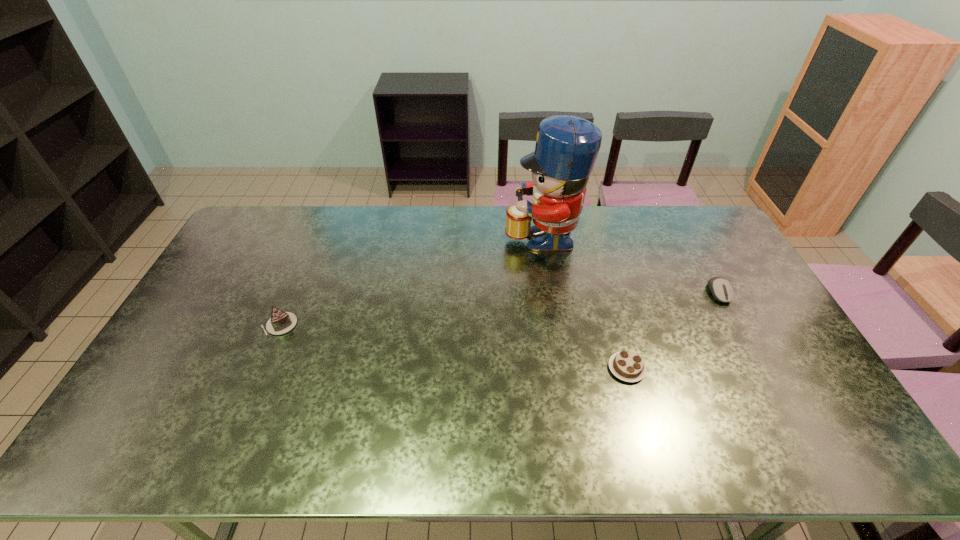
Image resolution: width=960 pixels, height=540 pixels. In order to click on free space between the nearest object and the nutcracker in this screenshot , I will do `click(585, 301)`.

Identify the location of free point between the second farthest object and the farthest object. Image resolution: width=960 pixels, height=540 pixels. (631, 264).

Locate an element on the screen. free space between the farther chocolate cake and the second farthest object is located at coordinates (499, 309).

At what (x,y) coordinates should I click in order to perform the action: click on vacant area between the tallest object and the right chocolate cake. Please return your answer as a coordinate pair (x, y). Image resolution: width=960 pixels, height=540 pixels. Looking at the image, I should click on (585, 301).

The width and height of the screenshot is (960, 540). I want to click on blank region between the second shortest object and the nearest object, so click(673, 330).

At what (x,y) coordinates should I click in order to perform the action: click on empty space between the nutcracker and the left chocolate cake. Please return your answer as a coordinate pair (x, y). This screenshot has height=540, width=960. Looking at the image, I should click on (411, 280).

Locate an element on the screen. The height and width of the screenshot is (540, 960). unoccupied position between the farthest object and the leftmost object is located at coordinates (411, 280).

Locate an element on the screen. The height and width of the screenshot is (540, 960). empty space that is in between the third tallest object and the shortest object is located at coordinates (673, 330).

The height and width of the screenshot is (540, 960). I want to click on free area in between the farthest object and the shortest object, so click(x=585, y=301).

Identify the location of free point between the shorter chocolate cake and the third shortest object. This screenshot has height=540, width=960. (453, 347).